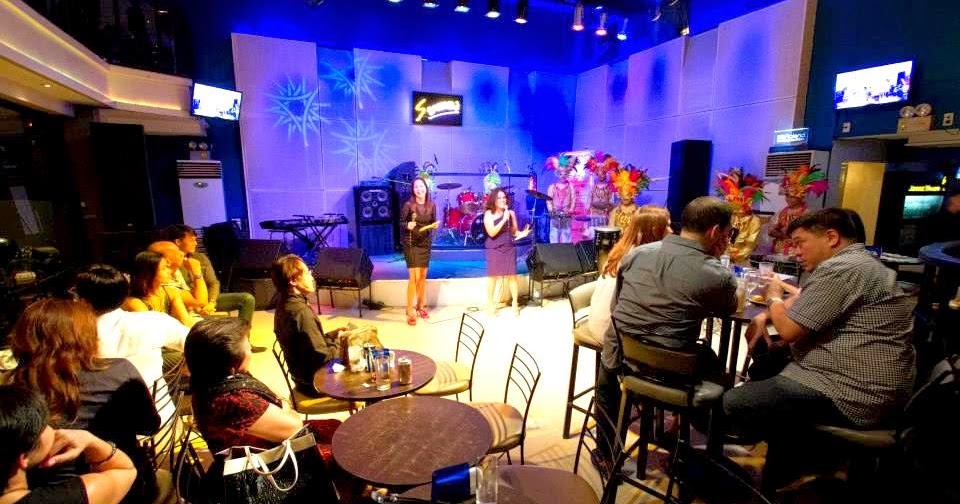
Where is `light`? The height and width of the screenshot is (504, 960). light is located at coordinates (618, 41), (603, 33), (579, 26), (516, 21), (491, 17), (467, 8), (421, 7), (391, 1), (680, 29).